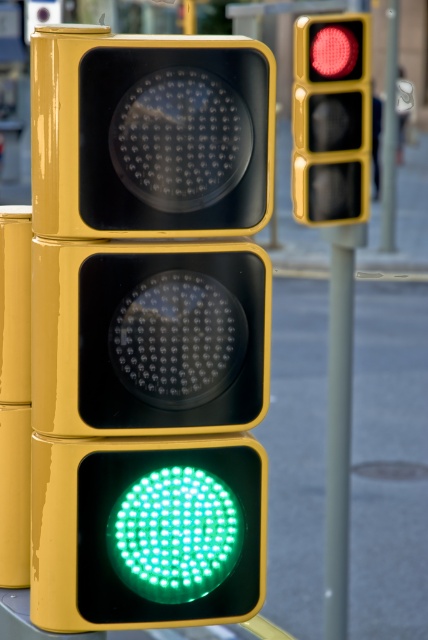
You are a pedestrian standing at the crosswalk and see the green led at bottom and the metallic pole at upper right. Which object is closer to the ground?

The green led at bottom is closer to the ground because it is positioned below the metallic pole at upper right.

You are standing in front of a traffic light system. You notice a point labeled as point (148,336). Which object does this point correspond to?

The point (148,336) corresponds to the glossy yellow traffic light at center.

You are a pedestrian standing in front of the traffic lights. You notice a specific point at coordinates point (330, 118). Which traffic light does this point belong to?

The point (330, 118) is on the matte red traffic light at upper right.